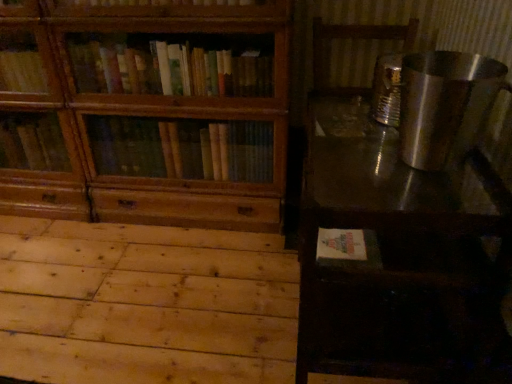
Question: Does metallic reflective table at right appear on the right side of natural wood plywood at lower left?

Choices:
 (A) no
 (B) yes

Answer: (B)

Question: Is metallic reflective table at right next to natural wood plywood at lower left?

Choices:
 (A) no
 (B) yes

Answer: (A)

Question: Does metallic reflective table at right have a greater width compared to natural wood plywood at lower left?

Choices:
 (A) no
 (B) yes

Answer: (A)

Question: Is metallic reflective table at right further to the viewer compared to natural wood plywood at lower left?

Choices:
 (A) no
 (B) yes

Answer: (A)

Question: From a real-world perspective, is metallic reflective table at right located higher than natural wood plywood at lower left?

Choices:
 (A) yes
 (B) no

Answer: (A)

Question: Considering the positions of point (32, 365) and point (448, 309), is point (32, 365) closer or farther from the camera than point (448, 309)?

Choices:
 (A) closer
 (B) farther

Answer: (B)

Question: From the image's perspective, is natural wood plywood at lower left positioned above or below metallic reflective table at right?

Choices:
 (A) below
 (B) above

Answer: (A)

Question: From a real-world perspective, is natural wood plywood at lower left positioned above or below metallic reflective table at right?

Choices:
 (A) above
 (B) below

Answer: (B)

Question: In the image, is natural wood plywood at lower left positioned in front of or behind metallic reflective table at right?

Choices:
 (A) behind
 (B) front

Answer: (A)

Question: Based on their sizes in the image, would you say metallic reflective table at right is bigger or smaller than natural wood plywood at lower left?

Choices:
 (A) small
 (B) big

Answer: (B)

Question: From the image's perspective, is metallic reflective table at right positioned above or below natural wood plywood at lower left?

Choices:
 (A) above
 (B) below

Answer: (A)

Question: Would you say metallic reflective table at right is to the left or to the right of natural wood plywood at lower left in the picture?

Choices:
 (A) left
 (B) right

Answer: (B)

Question: Is metallic reflective table at right wider or thinner than natural wood plywood at lower left?

Choices:
 (A) wide
 (B) thin

Answer: (B)

Question: From the image's perspective, is metallic reflective table at right positioned above or below wooden bookcase at left?

Choices:
 (A) above
 (B) below

Answer: (B)

Question: Considering the positions of point (304, 177) and point (61, 175), is point (304, 177) closer or farther from the camera than point (61, 175)?

Choices:
 (A) farther
 (B) closer

Answer: (B)